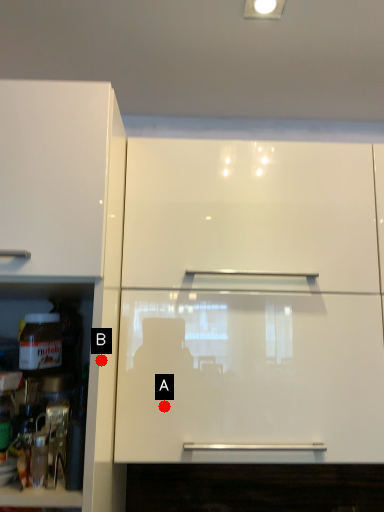
Question: Two points are circled on the image, labeled by A and B beside each circle. Which point is farther to the camera?

Choices:
 (A) A is further
 (B) B is further

Answer: (A)